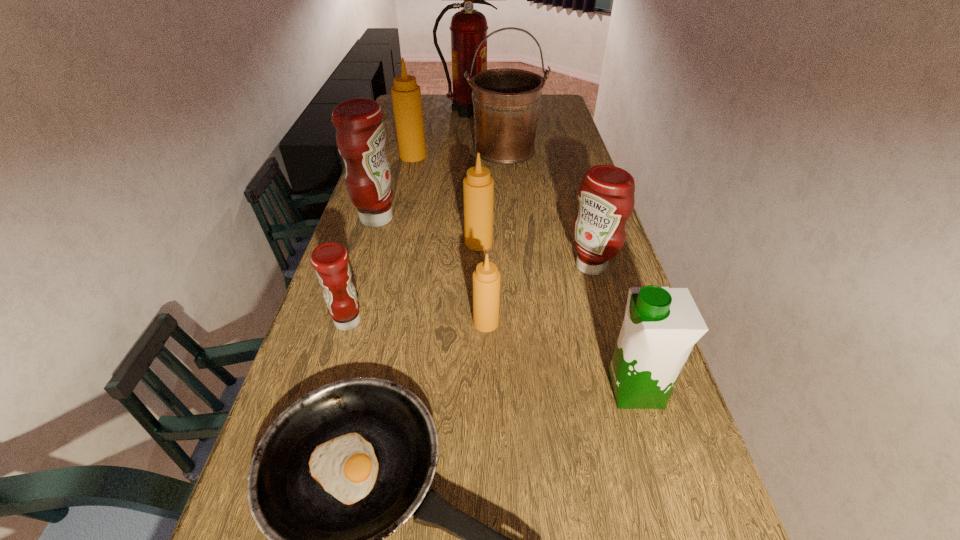
You are a GUI agent. You are given a task and a screenshot of the screen. Output one action in this format:
    pyautogui.click(x=<x>, y=<y>)
    Task: Click on the red fire extinguisher
    
    Given the screenshot: What is the action you would take?
    pyautogui.click(x=468, y=26)

Where is `fire extinguisher`? fire extinguisher is located at coordinates (468, 26).

Where is `bucket`? bucket is located at coordinates (506, 101).

I want to click on the farthest condiment, so point(406,95).

At what (x,y) coordinates should I click in order to perform the action: click on the leftmost tan condiment. Please return your answer as a coordinate pair (x, y). Looking at the image, I should click on (406, 95).

Identify the location of the biggest red condiment. This screenshot has height=540, width=960. (360, 134).

Image resolution: width=960 pixels, height=540 pixels. Identify the location of the second nearest tan condiment. (478, 186).

The image size is (960, 540). What are the coordinates of `the second smallest red condiment` in the screenshot? It's located at (606, 198).

Find the location of a particular element. This screenshot has height=540, width=960. the rightmost red condiment is located at coordinates (606, 198).

Identify the location of soya milk. The height and width of the screenshot is (540, 960). (661, 325).